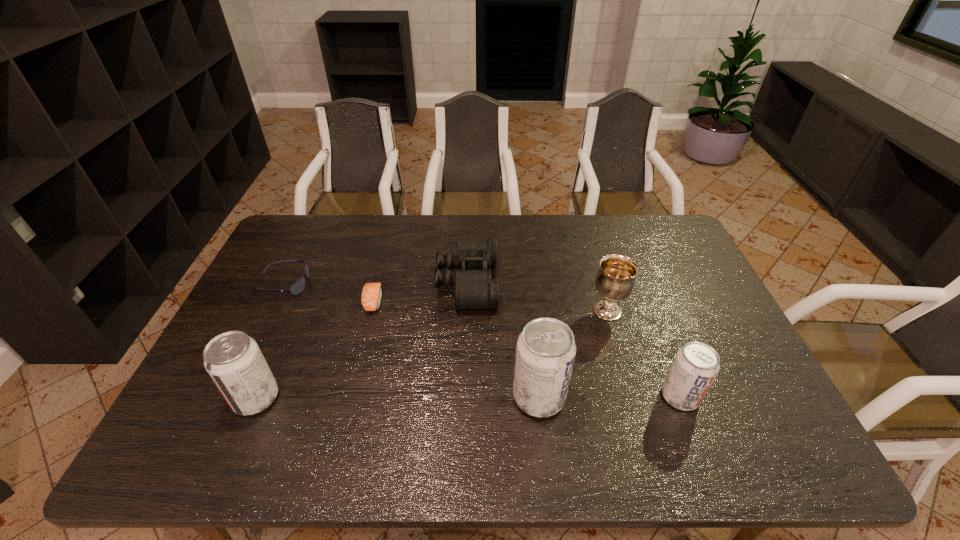
What are the coordinates of `the second tallest soda can` in the screenshot? It's located at (234, 361).

Locate an element on the screen. the second soda can from right to left is located at coordinates (545, 351).

The height and width of the screenshot is (540, 960). I want to click on the rightmost object, so click(x=696, y=365).

Where is `the rightmost soda can`? This screenshot has height=540, width=960. the rightmost soda can is located at coordinates (696, 365).

The height and width of the screenshot is (540, 960). In order to click on the fifth object from right to left in this screenshot , I will do `click(371, 296)`.

Where is `binoculars`? The image size is (960, 540). binoculars is located at coordinates (474, 289).

At what (x,y) coordinates should I click in order to perform the action: click on the fifth tallest object. Please return your answer as a coordinate pair (x, y). The height and width of the screenshot is (540, 960). Looking at the image, I should click on (474, 289).

Locate an element on the screen. The image size is (960, 540). sunglasses is located at coordinates (298, 286).

Find the location of a particular element. The width and height of the screenshot is (960, 540). chalice is located at coordinates (615, 280).

Locate an element on the screen. The image size is (960, 540). vacant area located 0.260m on the back of the second shortest soda can is located at coordinates (296, 306).